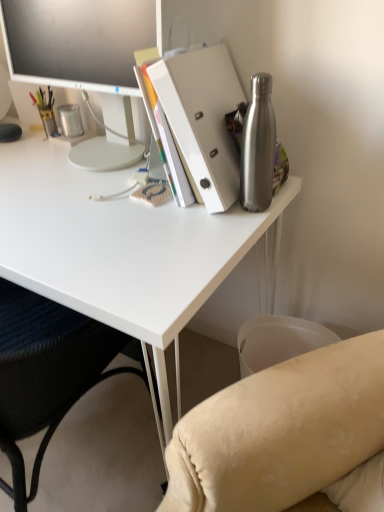
The width and height of the screenshot is (384, 512). Identify the location of space that is in front of metallic silver pen holder at left. (88, 150).